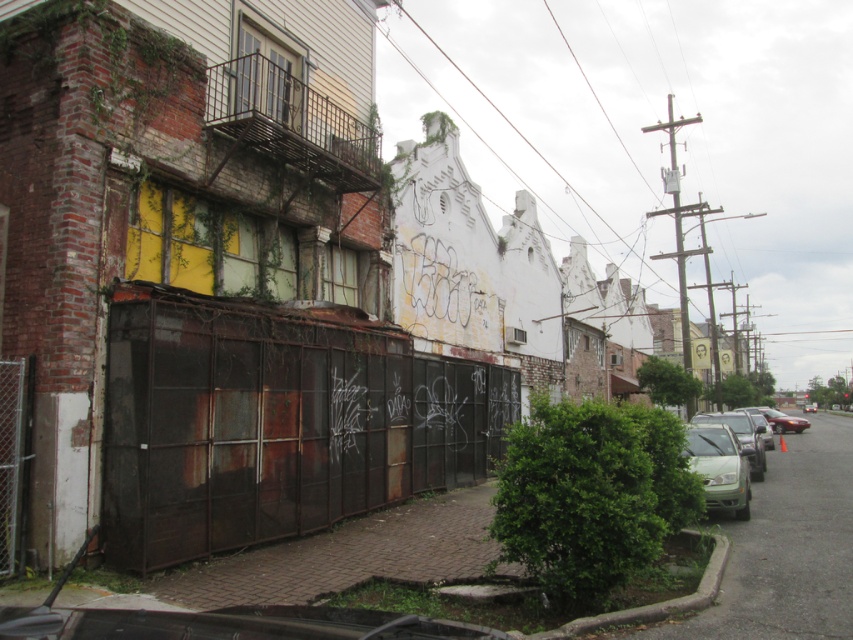
Question: Based on their relative distances, which object is farther from the rusty metal fence at center?

Choices:
 (A) green matte car at lower right
 (B) green matte sedan at right

Answer: (B)

Question: Is green matte sedan at right further to camera compared to rusty chain-link fence at lower left?

Choices:
 (A) no
 (B) yes

Answer: (B)

Question: Which point is farther from the camera taking this photo?

Choices:
 (A) (6, 497)
 (B) (706, 500)

Answer: (B)

Question: Can you confirm if rusty metal fence at center is positioned to the right of rusty chain-link fence at lower left?

Choices:
 (A) yes
 (B) no

Answer: (A)

Question: In this image, where is rusty metal fence at center located relative to green matte sedan at right?

Choices:
 (A) below
 (B) above

Answer: (B)

Question: Which object is closer to the camera taking this photo?

Choices:
 (A) rusty metal fence at center
 (B) green matte sedan at right

Answer: (A)